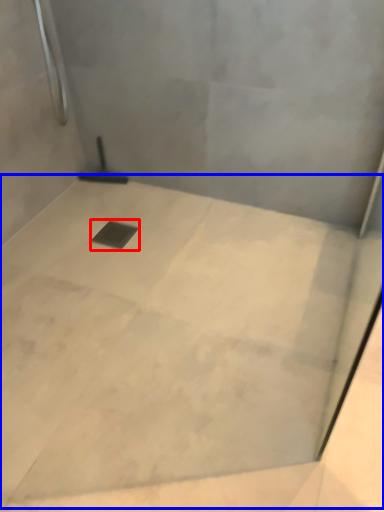
Question: Which of the following is the farthest to the observer, drain (highlighted by a red box) or concrete (highlighted by a blue box)?

Choices:
 (A) drain
 (B) concrete

Answer: (A)